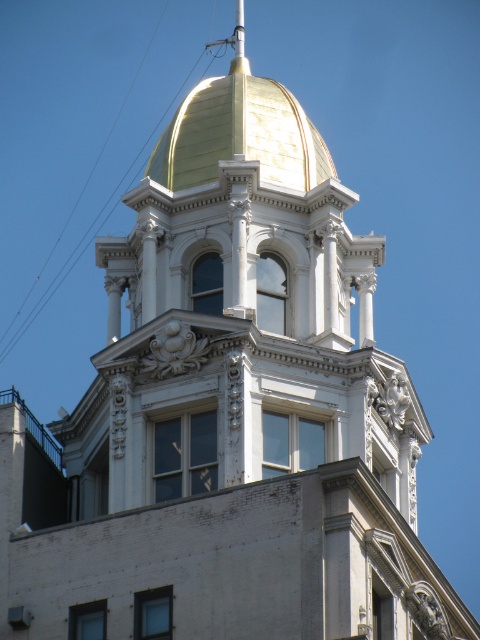
You are an architect analyzing the symmetry of the building. The gold polished dome at upper center is positioned at coordinates 0.212 on the x and 0.500 on the y. Considering the two arched windows with dark frames are symmetrically placed, where would you expect their central points to be in relation to the dome?

Since the two arched windows with dark frames are symmetrically placed and the gold polished dome at upper center is located at coordinates x 0.212 and y 0.500, their central points should be mirrored around the dome. This means one window would be to the left of the dome at x less than 0.212 and the other to the right at x greater than 0.212, maintaining the same y coordinate for symmetry.

You are an architect examining the building facade. You notice the gold polished dome at upper center and the transparent wire at upper left. Which object is closer to you from your vantage point?

The gold polished dome at upper center is closer to you because it is in front of the transparent wire at upper left.

You are an architect inspecting the building facade from the ground. You notice the gold polished dome at upper center and the transparent wire at upper left. Which object is positioned higher on the building?

The transparent wire at upper left is positioned higher on the building than the gold polished dome at upper center, as the dome is located below it.